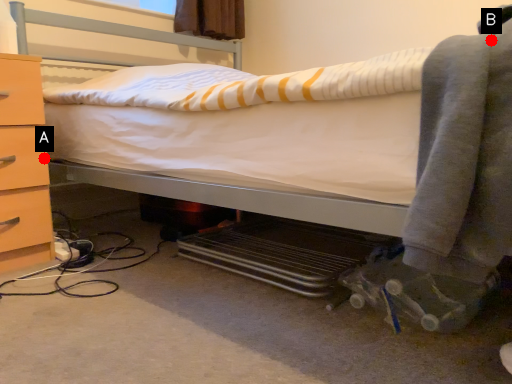
Question: Two points are circled on the image, labeled by A and B beside each circle. Which of the following is the farthest from the observer?

Choices:
 (A) A is further
 (B) B is further

Answer: (A)